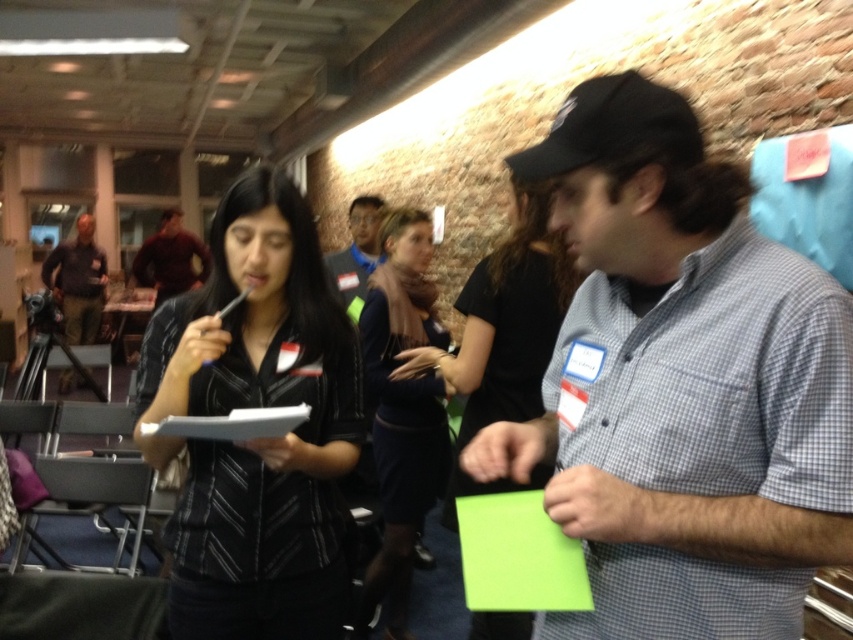
Question: Which of the following is the closest to the observer?

Choices:
 (A) (167, 257)
 (B) (349, 260)

Answer: (B)

Question: Which object is farther from the camera taking this photo?

Choices:
 (A) matte brown shirt at left
 (B) gray checkered shirt at center

Answer: (A)

Question: Which point is farther to the camera?

Choices:
 (A) (177, 248)
 (B) (430, 355)

Answer: (A)

Question: Is matte brown shirt at left to the right of maroon sweater at upper left from the viewer's perspective?

Choices:
 (A) no
 (B) yes

Answer: (A)

Question: From the image, what is the correct spatial relationship of matte brown shirt at left in relation to blue shirt at center?

Choices:
 (A) below
 (B) above

Answer: (B)

Question: Can you confirm if black fabric dress at center is smaller than matte brown shirt at left?

Choices:
 (A) yes
 (B) no

Answer: (A)